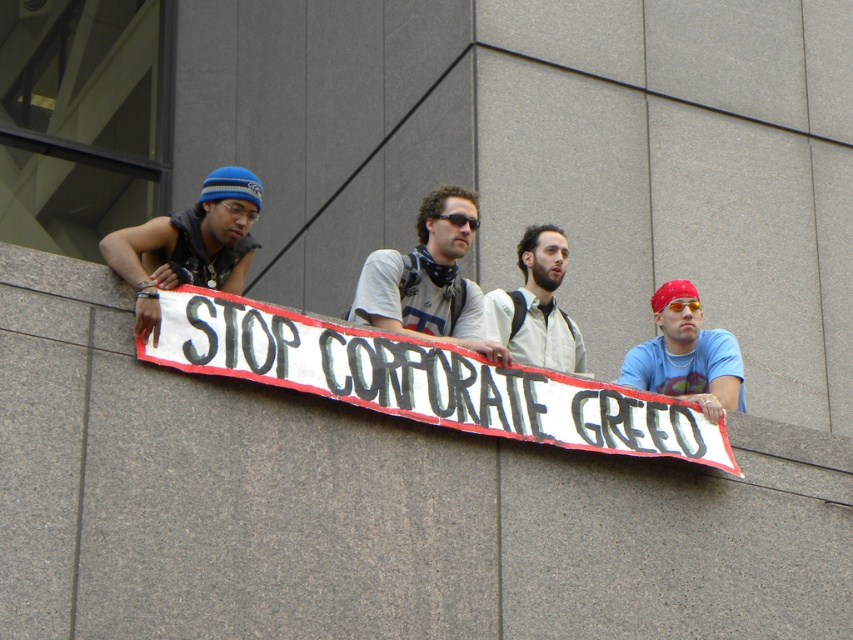
Can you confirm if white t-shirt at center is positioned below orange reflective goggles at center?

Actually, white t-shirt at center is above orange reflective goggles at center.

The image size is (853, 640). Describe the element at coordinates (428, 280) in the screenshot. I see `white t-shirt at center` at that location.

Measure the distance between white t-shirt at center and camera.

They are 42.65 meters apart.

Locate an element on the screen. This screenshot has width=853, height=640. white t-shirt at center is located at coordinates (428, 280).

Is point (700, 394) closer to viewer compared to point (253, 212)?

No, it is not.

Does red bandana at right have a greater width compared to blue knit cap at upper left?

Indeed, red bandana at right has a greater width compared to blue knit cap at upper left.

Where is `red bandana at right`? red bandana at right is located at coordinates (686, 356).

Does white shirt at center appear on the right side of blue knit cap at upper left?

Correct, you'll find white shirt at center to the right of blue knit cap at upper left.

The image size is (853, 640). I want to click on white shirt at center, so click(x=537, y=307).